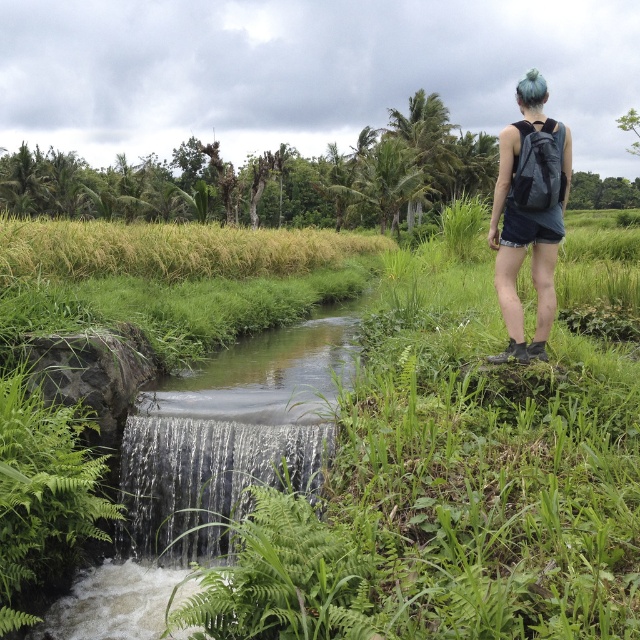
Question: Does green grass at upper left appear under clear water cascade at lower left?

Choices:
 (A) yes
 (B) no

Answer: (B)

Question: Is green grass at upper left in front of matte gray backpack at upper right?

Choices:
 (A) yes
 (B) no

Answer: (B)

Question: Considering the real-world distances, which object is farthest from the green grass at upper left?

Choices:
 (A) clear water cascade at lower left
 (B) matte gray backpack at upper right

Answer: (B)

Question: Which object appears farthest from the camera in this image?

Choices:
 (A) matte gray backpack at upper right
 (B) green grass at upper left

Answer: (B)

Question: Is green grass at upper left to the left of matte gray backpack at upper right from the viewer's perspective?

Choices:
 (A) no
 (B) yes

Answer: (B)

Question: Which point is closer to the camera?

Choices:
 (A) (524, 81)
 (B) (168, 211)
 (C) (154, 508)

Answer: (A)